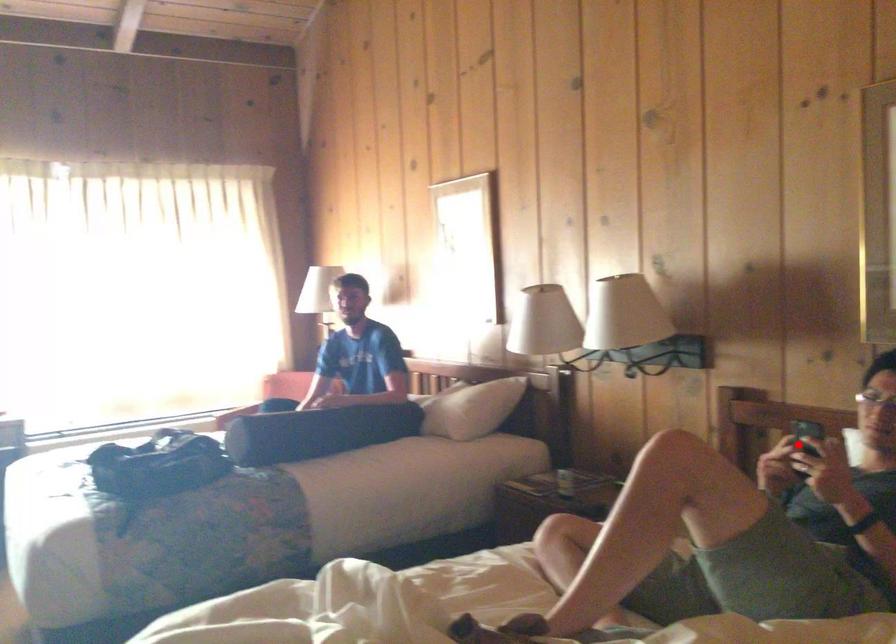
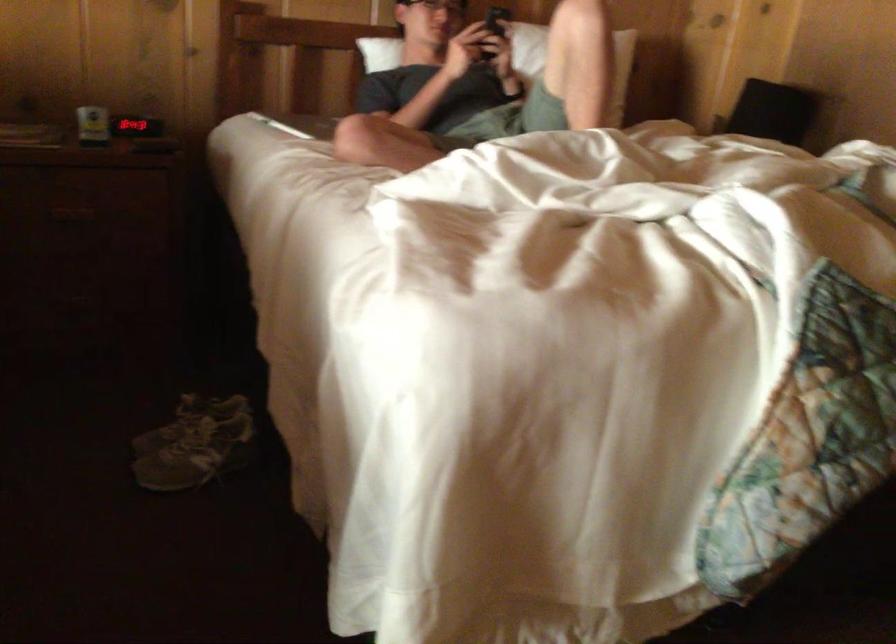
Find the pixel in the second image that matches the highlighted location in the first image.

(495, 24)